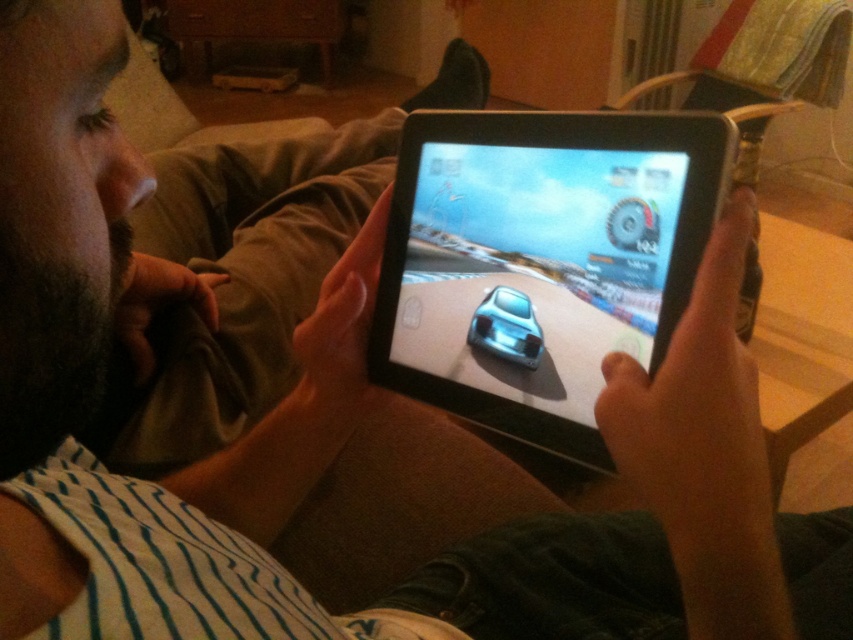
Is black glossy tablet at center above satin silver car at center?

Yes.

This screenshot has height=640, width=853. What do you see at coordinates (541, 259) in the screenshot?
I see `black glossy tablet at center` at bounding box center [541, 259].

Find the location of a particular element. black glossy tablet at center is located at coordinates (541, 259).